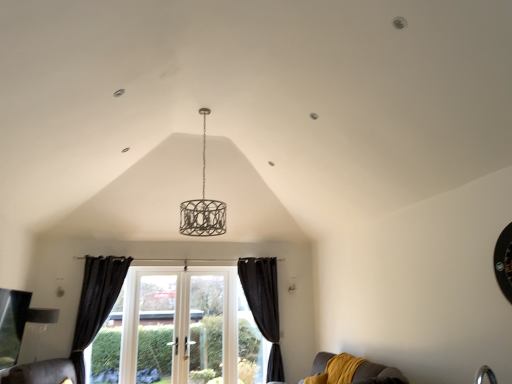
Question: Can you confirm if matte silver lampshade at lower left is bigger than velvet mustard couch at lower right?

Choices:
 (A) no
 (B) yes

Answer: (A)

Question: Could velvet mustard couch at lower right be considered to be inside matte silver lampshade at lower left?

Choices:
 (A) no
 (B) yes

Answer: (A)

Question: Considering the relative positions of matte silver lampshade at lower left and velvet mustard couch at lower right in the image provided, is matte silver lampshade at lower left in front of velvet mustard couch at lower right?

Choices:
 (A) yes
 (B) no

Answer: (B)

Question: Can you see matte silver lampshade at lower left touching velvet mustard couch at lower right?

Choices:
 (A) no
 (B) yes

Answer: (A)

Question: Could you tell me if matte silver lampshade at lower left is turned towards velvet mustard couch at lower right?

Choices:
 (A) yes
 (B) no

Answer: (B)

Question: In the image, is black velvet curtain at left, which appears as the first curtain when viewed from the left, on the left side or the right side of velvet mustard couch at lower right?

Choices:
 (A) left
 (B) right

Answer: (A)

Question: Looking at their shapes, would you say black velvet curtain at left, which is counted as the second curtain, starting from the right, is wider or thinner than velvet mustard couch at lower right?

Choices:
 (A) wide
 (B) thin

Answer: (B)

Question: Is black velvet curtain at left, which is counted as the second curtain, starting from the right, in front of or behind velvet mustard couch at lower right in the image?

Choices:
 (A) behind
 (B) front

Answer: (A)

Question: Is black velvet curtain at left, which is counted as the second curtain, starting from the right, situated inside velvet mustard couch at lower right or outside?

Choices:
 (A) outside
 (B) inside

Answer: (A)

Question: Considering the positions of point coord(272,301) and point coord(94,302), is point coord(272,301) closer or farther from the camera than point coord(94,302)?

Choices:
 (A) farther
 (B) closer

Answer: (A)

Question: Would you say black velvet curtain at lower center, which ranks as the first curtain in right-to-left order, is to the left or to the right of black velvet curtain at left, which is counted as the second curtain, starting from the right, in the picture?

Choices:
 (A) left
 (B) right

Answer: (B)

Question: Based on their sizes in the image, would you say black velvet curtain at lower center, which ranks as the first curtain in right-to-left order, is bigger or smaller than black velvet curtain at left, which is counted as the second curtain, starting from the right?

Choices:
 (A) big
 (B) small

Answer: (A)

Question: From a real-world perspective, is black velvet curtain at lower center, arranged as the second curtain when viewed from the left, above or below black velvet curtain at left, which appears as the first curtain when viewed from the left?

Choices:
 (A) below
 (B) above

Answer: (A)

Question: Is velvet mustard couch at lower right bigger or smaller than matte silver lampshade at lower left?

Choices:
 (A) small
 (B) big

Answer: (B)

Question: Is velvet mustard couch at lower right to the left or to the right of matte silver lampshade at lower left in the image?

Choices:
 (A) right
 (B) left

Answer: (A)